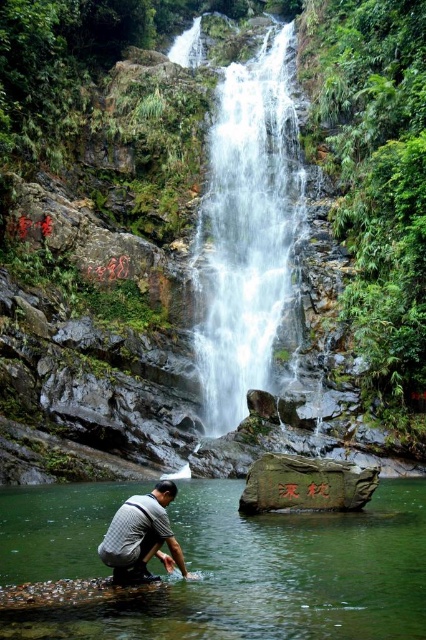
You are standing at the edge of the waterfall and notice the clear water at center and the gray fabric shirt at lower center. Which object takes up more visual space in the image?

The clear water at center takes up more visual space than the gray fabric shirt at lower center because it is bigger in size according to the description.

You are a hiker standing at the edge of the waterfall scene. You see the clear water at center and the gray fabric shirt at lower center. Which object is higher in elevation?

The clear water at center is much taller than the gray fabric shirt at lower center, so the clear water at center is higher in elevation.